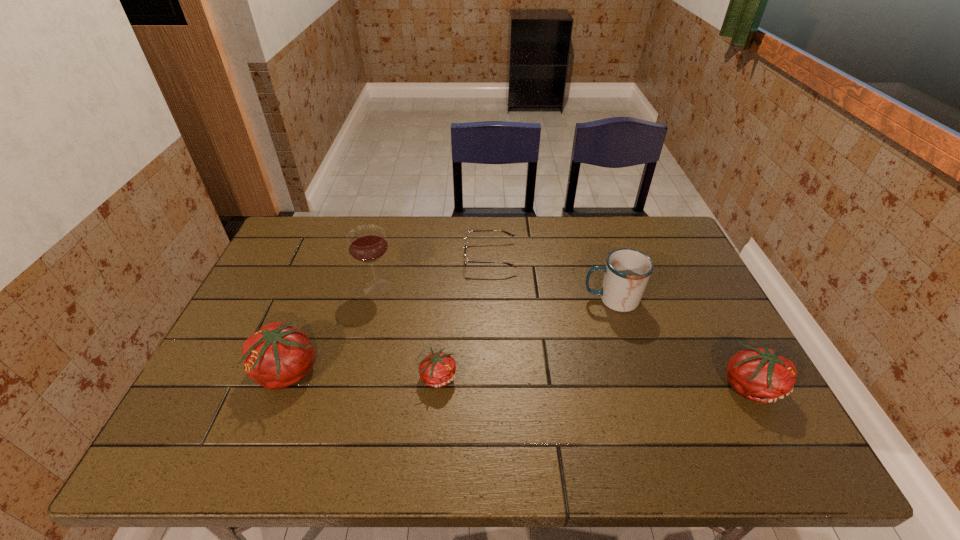
The width and height of the screenshot is (960, 540). Find the location of `vacant position for inserting another tomato evenly`. vacant position for inserting another tomato evenly is located at coordinates (593, 380).